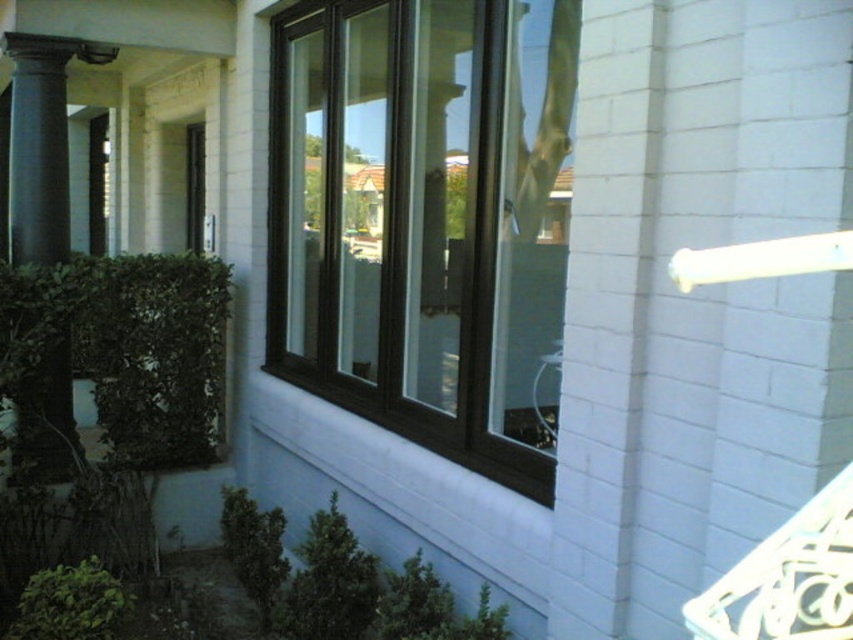
You are standing directly in front of the building shown in the image. Where exactly is the brown wood window at center located relative to your viewpoint?

The brown wood window at center is located at the central area of the building facade, positioned at coordinates approximately 0.345 on the x axis and 0.498 on the y axis relative to the image frame.

You are an architect designing a new building facade. You need to ensure that the brown wood window at center and the dark gray stone column at left are proportionate. Based on the image, which object has a greater width?

The brown wood window at center has a greater width than the dark gray stone column at left according to the description.